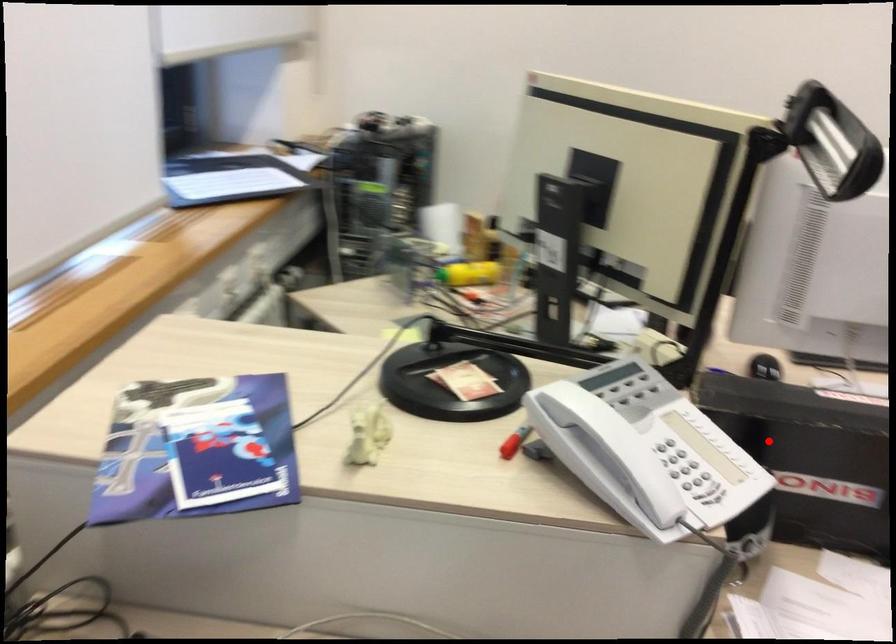
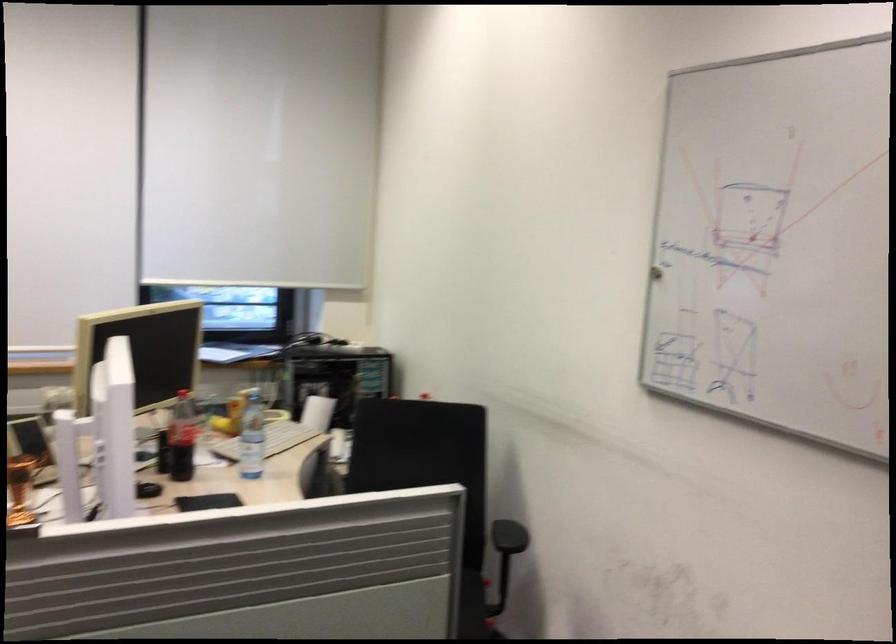
Locate, in the second image, the point that corresponds to the highlighted location in the first image.

(20, 489)